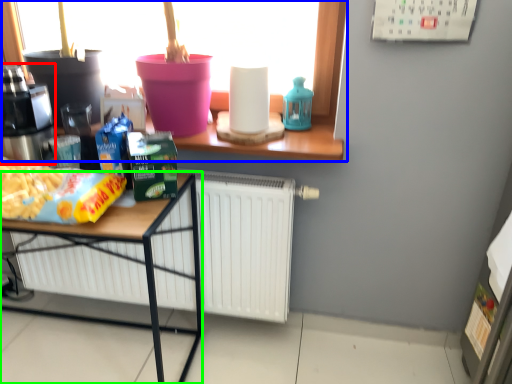
Question: Considering the real-world distances, which object is closest to coffee machine (highlighted by a red box)? window (highlighted by a blue box) or desk (highlighted by a green box).

Choices:
 (A) window
 (B) desk

Answer: (B)